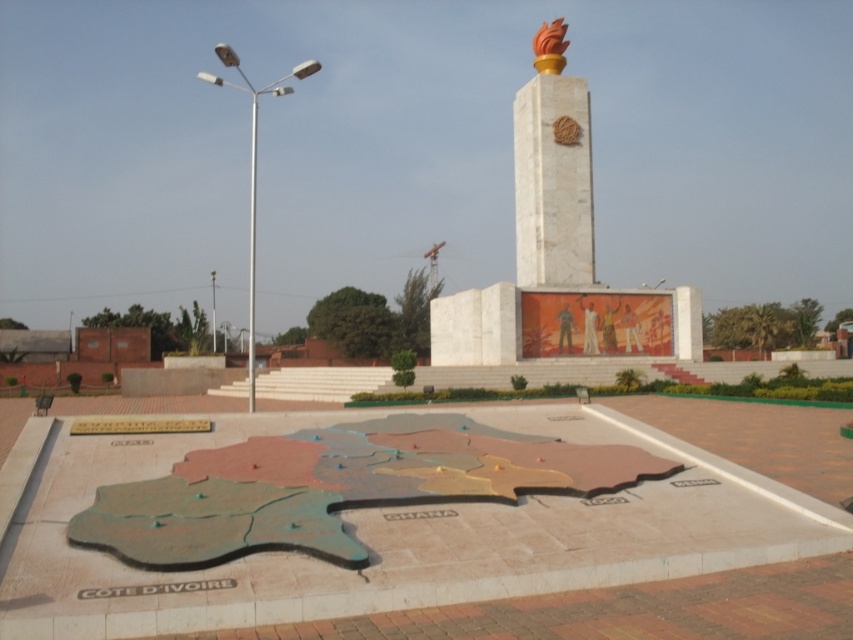
You are standing in the plaza and want to locate the white marble monument at center. What are its coordinates in the image?

The white marble monument at center is located at coordinates (558, 252).

You are standing in the plaza and want to take a photo of both the white marble monument at center and the white marble obelisk at upper center. Which one should you focus on first if you want to capture both in a single frame without moving your camera?

You should focus on the white marble monument at center first since it is taller than the white marble obelisk at upper center, allowing you to frame it properly while still including the obelisk in the shot.

You are standing in the plaza and want to take a photo of the monument. There are two points marked as point 1 at coordinates (517, 282) and point 2 at coordinates (540, 216). Which point should you choose to ensure the monument is fully visible without any obstruction from the map sculpture?

You should choose point 2 at coordinates (540, 216) because point 1 at coordinates (517, 282) is behind it, meaning the monument might be partially blocked by the map sculpture if you stand at point 1.